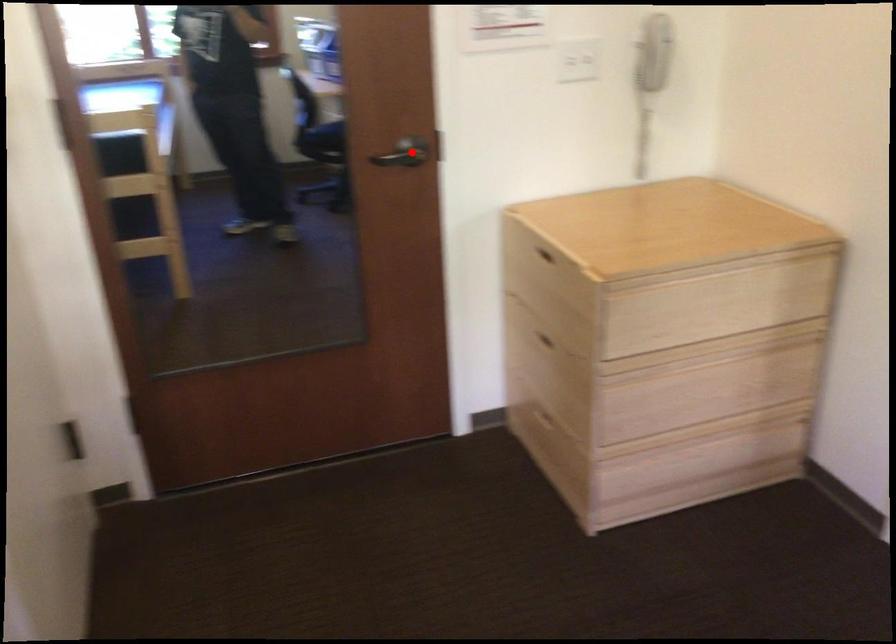
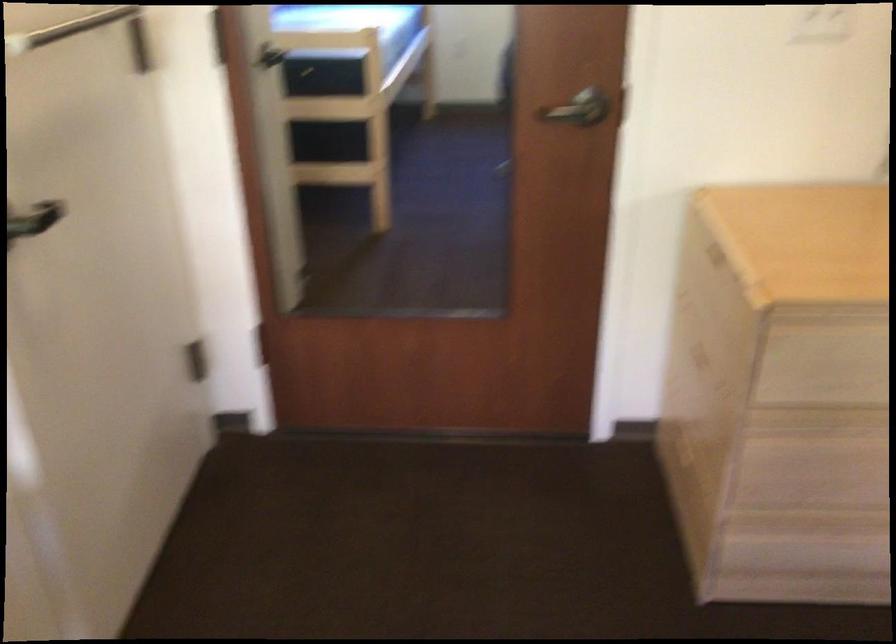
Question: I am providing you with two images of the same scene from different viewpoints. In image1, a red point is highlighted. Considering the same 3D point in image2, which of the following is correct?

Choices:
 (A) It is closer
 (B) It is farther

Answer: (A)